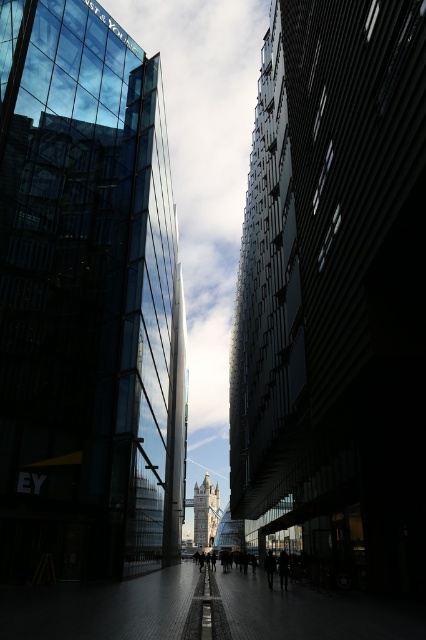
Question: Which point is closer to the camera taking this photo?

Choices:
 (A) (282, 586)
 (B) (265, 560)
 (C) (199, 547)

Answer: (A)

Question: Is silver metallic clock tower at center in front of silhouette figure at center?

Choices:
 (A) yes
 (B) no

Answer: (B)

Question: Which of these objects is positioned closest to the transparent glass tower at center?

Choices:
 (A) dark clothing at center
 (B) silhouette figure at center
 (C) silver metallic clock tower at center

Answer: (A)

Question: Does silhouette figure at center have a greater width compared to dark clothing at center?

Choices:
 (A) yes
 (B) no

Answer: (B)

Question: Considering the real-world distances, which object is closest to the dark clothing at center?

Choices:
 (A) silver metallic clock tower at center
 (B) dark glass skyscraper at center

Answer: (B)

Question: Does silhouette figure at center appear on the right side of dark clothing at center?

Choices:
 (A) yes
 (B) no

Answer: (A)